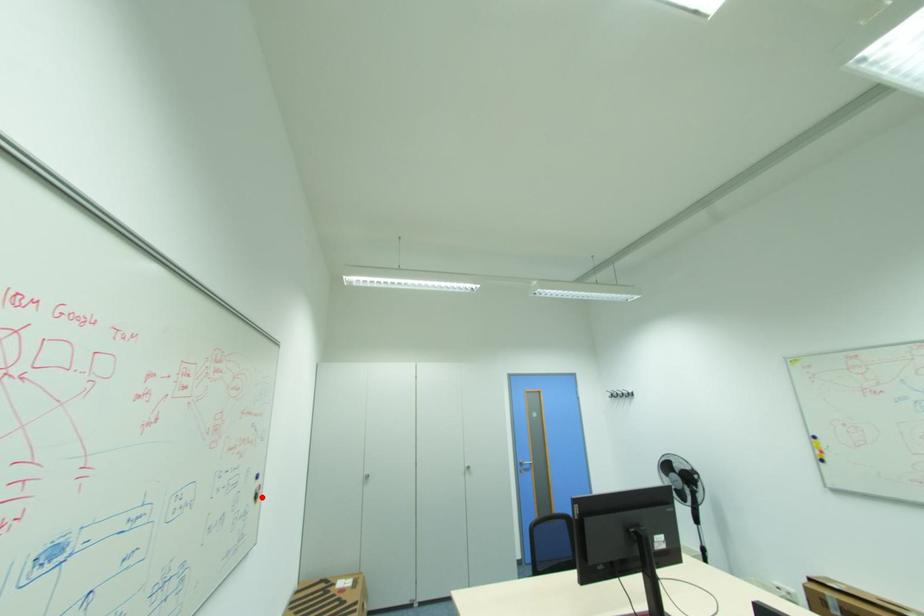
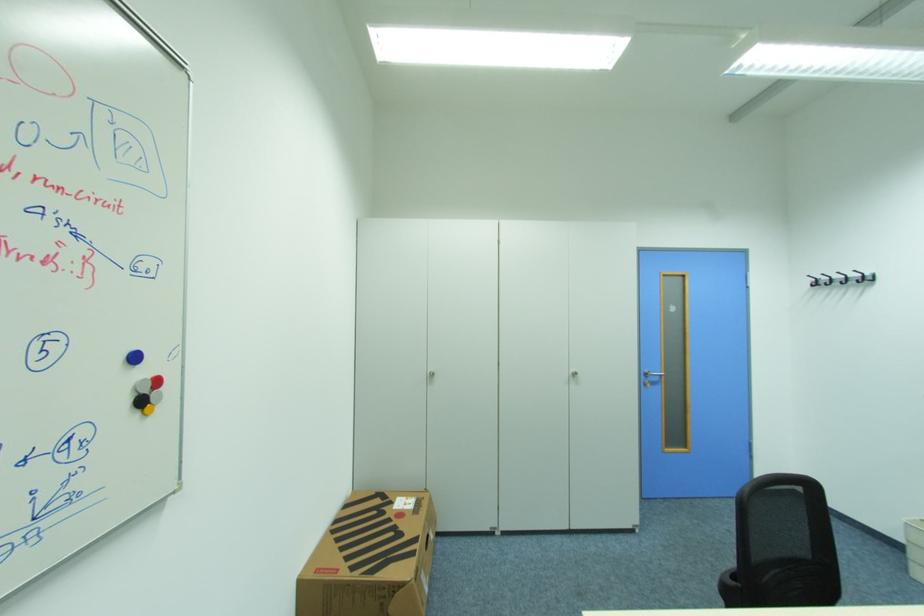
Where in the second image is the point corresponding to the highlighted location from the first image?

(146, 403)